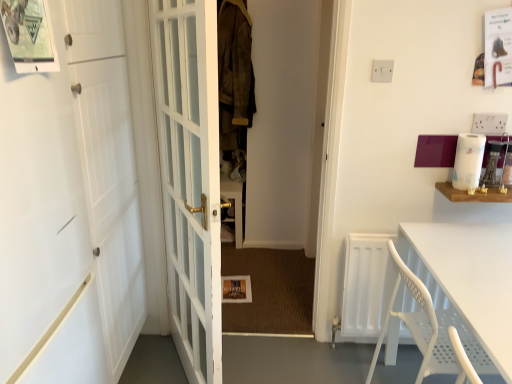
Question: In terms of height, does white plastic table at lower right look taller or shorter compared to white matte door at left, placed as the second door when sorted from right to left?

Choices:
 (A) short
 (B) tall

Answer: (A)

Question: From the image's perspective, is white plastic table at lower right located above or below white matte door at left, marked as the 1th door in a left-to-right arrangement?

Choices:
 (A) above
 (B) below

Answer: (B)

Question: Which object is the farthest from the white plastic table at lower right?

Choices:
 (A) white matte door at left, marked as the 1th door in a left-to-right arrangement
 (B) white paper towel at upper right
 (C) suede jacket at center
 (D) white glass door at center, acting as the 2th door starting from the left

Answer: (C)

Question: Based on their relative distances, which object is nearer to the white glass door at center, acting as the 2th door starting from the left?

Choices:
 (A) white paper towel at upper right
 (B) suede jacket at center
 (C) white matte door at left, placed as the second door when sorted from right to left
 (D) white plastic table at lower right

Answer: (C)